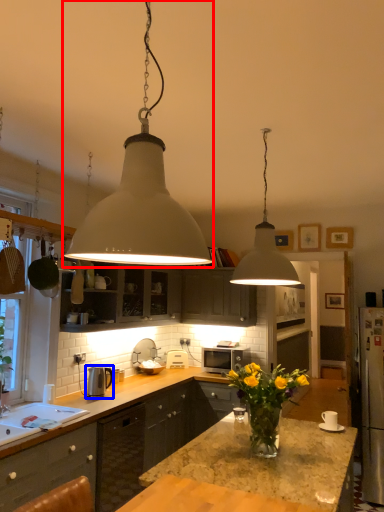
Question: Which of the following is the farthest to the observer, lamp (highlighted by a red box) or appliance (highlighted by a blue box)?

Choices:
 (A) lamp
 (B) appliance

Answer: (B)